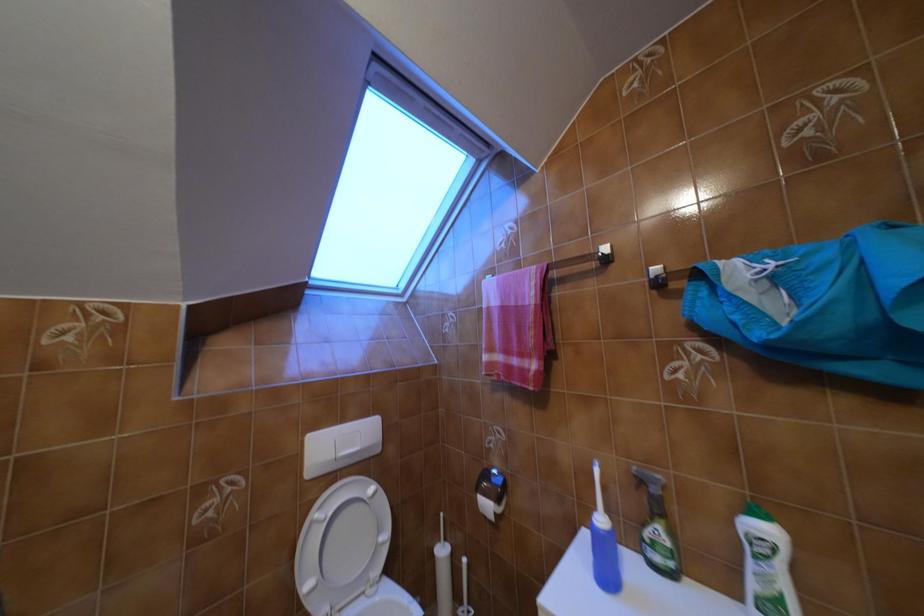
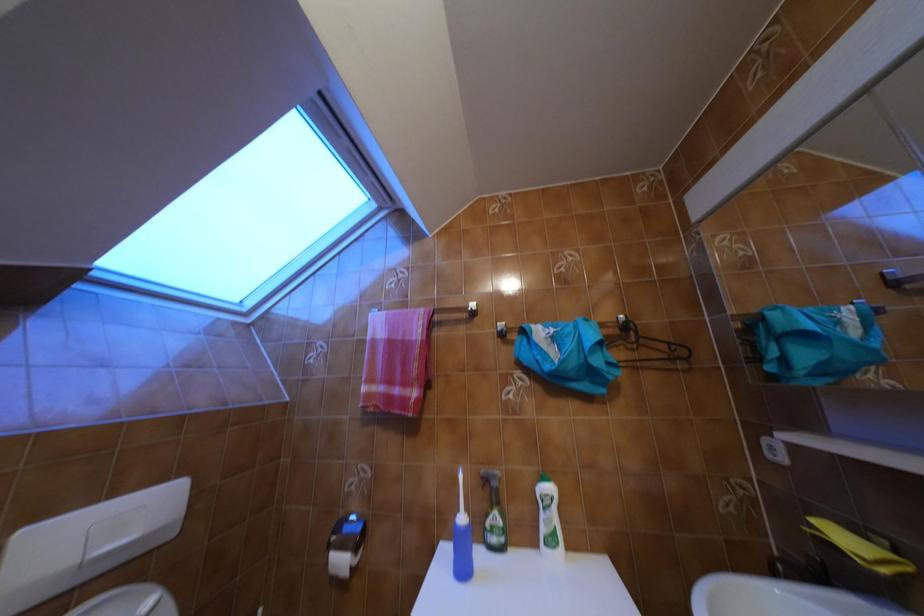
Question: The camera is either moving clockwise (left) or counter-clockwise (right) around the object. The first image is from the beginning of the video and the second image is from the end. Is the camera moving left or right when shooting the video?

Choices:
 (A) Left
 (B) Right

Answer: (A)